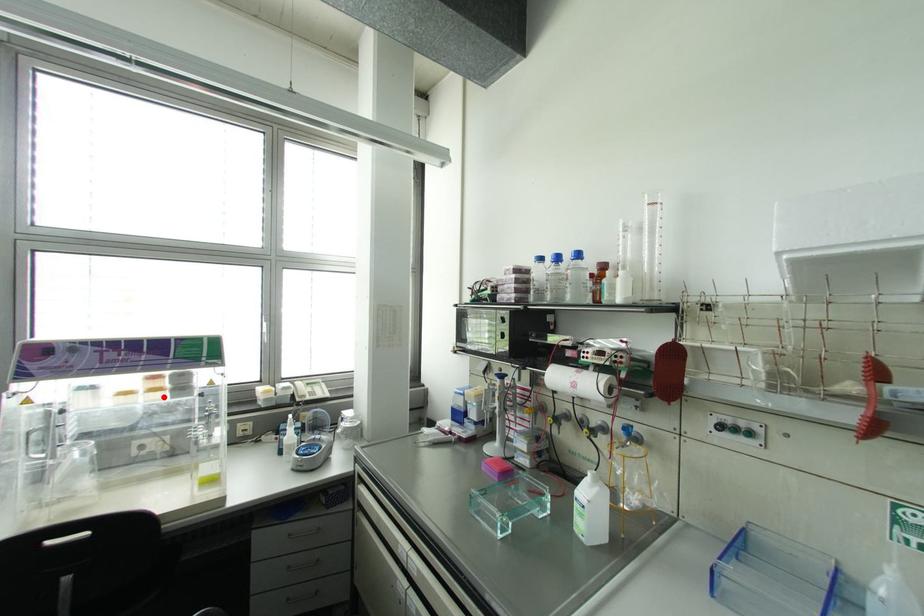
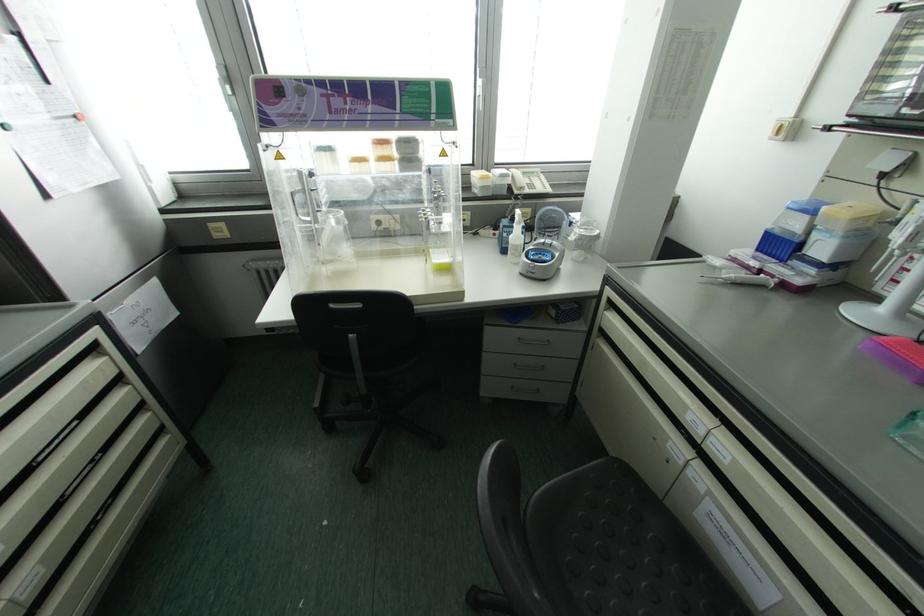
Question: A red point is marked in image1. In image2, is the corresponding 3D point closer to the camera or farther? Reply with the corresponding letter.

Choices:
 (A) The corresponding 3D point is closer.
 (B) The corresponding 3D point is farther.

Answer: (A)